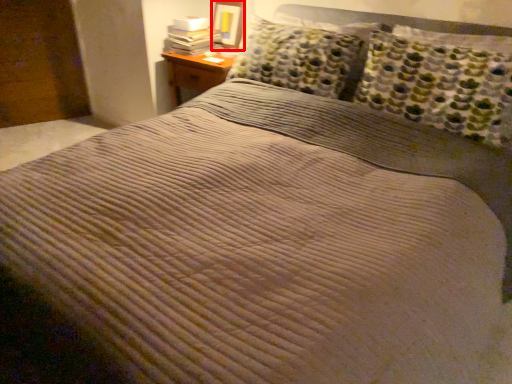
Question: In this image, where is picture frame (annotated by the red box) located relative to book?

Choices:
 (A) left
 (B) right

Answer: (B)